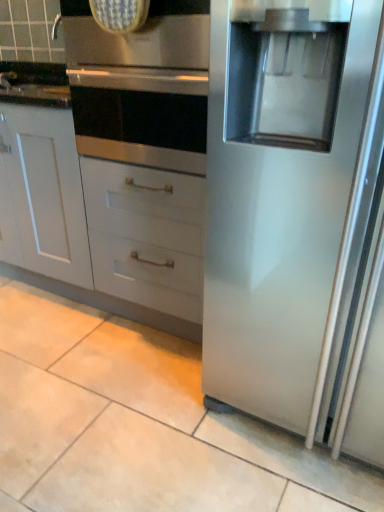
In order to face white matte cabinet at lower left, should I rotate leftwards or rightwards?

It's best to rotate left around 17.688 degrees.

Locate an element on the screen. white matte cabinet at lower left is located at coordinates (104, 226).

The image size is (384, 512). What do you see at coordinates (104, 226) in the screenshot?
I see `white matte cabinet at lower left` at bounding box center [104, 226].

Describe the element at coordinates (141, 86) in the screenshot. I see `stainless steel oven at upper center` at that location.

At what (x,y) coordinates should I click in order to perform the action: click on stainless steel oven at upper center. Please return your answer as a coordinate pair (x, y). The image size is (384, 512). Looking at the image, I should click on (141, 86).

Where is `white matte cabinet at lower left`? white matte cabinet at lower left is located at coordinates (104, 226).

Would you say stainless steel oven at upper center is to the left or to the right of white matte cabinet at lower left in the picture?

Based on their positions, stainless steel oven at upper center is located to the right of white matte cabinet at lower left.

Who is more distant, stainless steel oven at upper center or white matte cabinet at lower left?

white matte cabinet at lower left is further from the camera.

Is point (206, 16) closer or farther from the camera than point (24, 116)?

Point (206, 16).

From the image's perspective, between stainless steel oven at upper center and white matte cabinet at lower left, which one is located above?

stainless steel oven at upper center appears higher in the image.

Consider the image. From a real-world perspective, which is physically below, stainless steel oven at upper center or white matte cabinet at lower left?

From a 3D spatial view, white matte cabinet at lower left is below.

Does stainless steel oven at upper center have a greater width compared to white matte cabinet at lower left?

Indeed, stainless steel oven at upper center has a greater width compared to white matte cabinet at lower left.

Between stainless steel oven at upper center and white matte cabinet at lower left, which one has less height?

With less height is stainless steel oven at upper center.

Is stainless steel oven at upper center smaller than white matte cabinet at lower left?

Yes.

Is stainless steel oven at upper center outside of white matte cabinet at lower left?

Indeed, stainless steel oven at upper center is completely outside white matte cabinet at lower left.

Are stainless steel oven at upper center and white matte cabinet at lower left far apart?

stainless steel oven at upper center is near white matte cabinet at lower left, not far away.

Could you tell me if stainless steel oven at upper center is turned towards white matte cabinet at lower left?

No, stainless steel oven at upper center is not facing towards white matte cabinet at lower left.

Consider the image. Can you tell me how much stainless steel oven at upper center and white matte cabinet at lower left differ in facing direction?

The angular difference between stainless steel oven at upper center and white matte cabinet at lower left is 0.00254 degrees.

Locate an element on the screen. oven in front of the white matte cabinet at lower left is located at coordinates (141, 86).

Considering the relative positions of white matte cabinet at lower left and stainless steel oven at upper center in the image provided, is white matte cabinet at lower left to the left or to the right of stainless steel oven at upper center?

white matte cabinet at lower left is to the left of stainless steel oven at upper center.

Which object is more forward, white matte cabinet at lower left or stainless steel oven at upper center?

Positioned in front is stainless steel oven at upper center.

Which point is more distant from viewer, (x=147, y=281) or (x=191, y=45)?

The point (x=147, y=281) is more distant.

From the image's perspective, is white matte cabinet at lower left over stainless steel oven at upper center?

Actually, white matte cabinet at lower left appears below stainless steel oven at upper center in the image.

From a real-world perspective, does white matte cabinet at lower left stand above stainless steel oven at upper center?

Incorrect, from a real-world perspective, white matte cabinet at lower left is lower than stainless steel oven at upper center.

Can you confirm if white matte cabinet at lower left is thinner than stainless steel oven at upper center?

Correct, the width of white matte cabinet at lower left is less than that of stainless steel oven at upper center.

Based on the photo, is white matte cabinet at lower left taller than stainless steel oven at upper center?

Yes, white matte cabinet at lower left is taller than stainless steel oven at upper center.

Between white matte cabinet at lower left and stainless steel oven at upper center, which one has larger size?

white matte cabinet at lower left.

Is white matte cabinet at lower left inside the boundaries of stainless steel oven at upper center, or outside?

The correct answer is: outside.

Is white matte cabinet at lower left next to stainless steel oven at upper center?

No.

Is white matte cabinet at lower left facing towards stainless steel oven at upper center?

No, white matte cabinet at lower left is not oriented towards stainless steel oven at upper center.

Can you tell me how much white matte cabinet at lower left and stainless steel oven at upper center differ in facing direction?

0.00254 degrees.

I want to click on oven above the white matte cabinet at lower left (from a real-world perspective), so 141,86.

The width and height of the screenshot is (384, 512). Identify the location of oven above the white matte cabinet at lower left (from a real-world perspective). (141, 86).

Find the location of a particular element. The image size is (384, 512). oven that appears in front of the white matte cabinet at lower left is located at coordinates (141, 86).